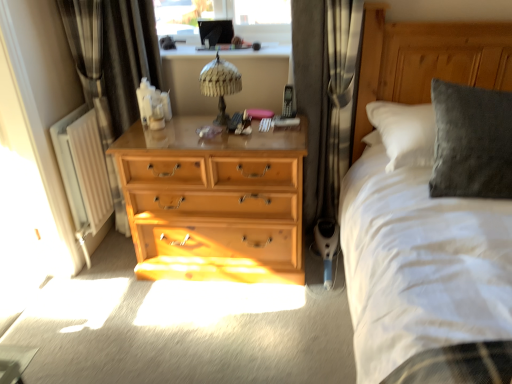
Where is `free space to the left of black fabric curtain at left, placed as the first curtain when sorted from left to right`? This screenshot has height=384, width=512. free space to the left of black fabric curtain at left, placed as the first curtain when sorted from left to right is located at coordinates (113, 252).